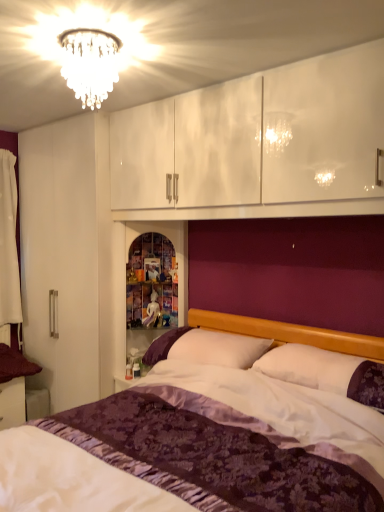
Question: From the image's perspective, is crystal chandelier at upper center under white soft pillow at center?

Choices:
 (A) no
 (B) yes

Answer: (A)

Question: Can white soft pillow at center be found inside crystal chandelier at upper center?

Choices:
 (A) yes
 (B) no

Answer: (B)

Question: From the image's perspective, is crystal chandelier at upper center on top of white soft pillow at center?

Choices:
 (A) yes
 (B) no

Answer: (A)

Question: Is crystal chandelier at upper center completely or partially outside of white soft pillow at center?

Choices:
 (A) no
 (B) yes

Answer: (B)

Question: Is crystal chandelier at upper center taller than white soft pillow at center?

Choices:
 (A) no
 (B) yes

Answer: (B)

Question: Considering the positions of purple satin bed at center and white fabric curtain at left in the image, is purple satin bed at center taller or shorter than white fabric curtain at left?

Choices:
 (A) tall
 (B) short

Answer: (B)

Question: Considering the positions of purple satin bed at center and white fabric curtain at left in the image, is purple satin bed at center wider or thinner than white fabric curtain at left?

Choices:
 (A) thin
 (B) wide

Answer: (B)

Question: Is point (188, 344) closer or farther from the camera than point (16, 301)?

Choices:
 (A) farther
 (B) closer

Answer: (B)

Question: From a real-world perspective, is purple satin bed at center above or below white fabric curtain at left?

Choices:
 (A) below
 (B) above

Answer: (A)

Question: In terms of height, does crystal chandelier at upper center look taller or shorter compared to white fabric curtain at left?

Choices:
 (A) tall
 (B) short

Answer: (B)

Question: Which is correct: crystal chandelier at upper center is inside white fabric curtain at left, or outside of it?

Choices:
 (A) inside
 (B) outside

Answer: (B)

Question: Is crystal chandelier at upper center bigger or smaller than white fabric curtain at left?

Choices:
 (A) small
 (B) big

Answer: (B)

Question: From the image's perspective, relative to white fabric curtain at left, is crystal chandelier at upper center above or below?

Choices:
 (A) below
 (B) above

Answer: (B)

Question: Considering their positions, is white soft pillow at center located in front of or behind white fabric curtain at left?

Choices:
 (A) behind
 (B) front

Answer: (B)

Question: Considering the positions of white soft pillow at center and white fabric curtain at left in the image, is white soft pillow at center bigger or smaller than white fabric curtain at left?

Choices:
 (A) big
 (B) small

Answer: (A)